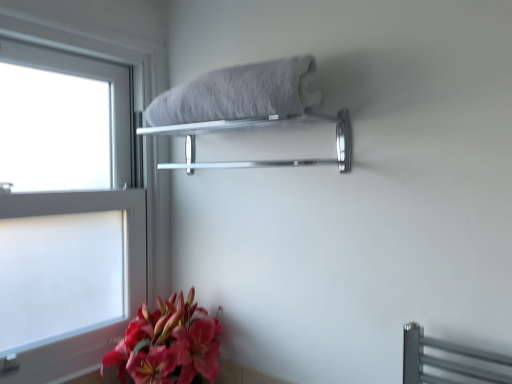
At what (x,y) coordinates should I click in order to perform the action: click on matte pink lily at lower left. Please return your answer as a coordinate pair (x, y). This screenshot has height=384, width=512. Looking at the image, I should click on (168, 345).

What do you see at coordinates (168, 345) in the screenshot? Image resolution: width=512 pixels, height=384 pixels. I see `matte pink lily at lower left` at bounding box center [168, 345].

Measure the distance between silver metallic towel rack at upper center and camera.

silver metallic towel rack at upper center is 99.20 centimeters from camera.

At what (x,y) coordinates should I click in order to perform the action: click on clear glass window at left. Please return your answer as a coordinate pair (x, y). This screenshot has height=384, width=512. Looking at the image, I should click on (65, 213).

How many degrees apart are the facing directions of clear glass window at left and gray fluffy bath towel at upper center?

90.1 degrees separate the facing orientations of clear glass window at left and gray fluffy bath towel at upper center.

Does clear glass window at left turn towards gray fluffy bath towel at upper center?

Yes, clear glass window at left is facing gray fluffy bath towel at upper center.

From their relative heights in the image, would you say clear glass window at left is taller or shorter than gray fluffy bath towel at upper center?

clear glass window at left is taller than gray fluffy bath towel at upper center.

Is clear glass window at left bigger or smaller than gray fluffy bath towel at upper center?

In the image, clear glass window at left appears to be larger than gray fluffy bath towel at upper center.

How many degrees apart are the facing directions of silver metallic towel rack at upper center and clear glass window at left?

The facing directions of silver metallic towel rack at upper center and clear glass window at left are 90.1 degrees apart.

Which object is wider, silver metallic towel rack at upper center or clear glass window at left?

silver metallic towel rack at upper center.

Is silver metallic towel rack at upper center not inside clear glass window at left?

Indeed, silver metallic towel rack at upper center is completely outside clear glass window at left.

Considering the relative sizes of silver metallic towel rack at upper center and clear glass window at left in the image provided, is silver metallic towel rack at upper center smaller than clear glass window at left?

Correct, silver metallic towel rack at upper center occupies less space than clear glass window at left.

Based on the photo, what's the angular difference between silver metallic towel rack at upper center and gray fluffy bath towel at upper center's facing directions?

silver metallic towel rack at upper center and gray fluffy bath towel at upper center are facing 0.00149 degrees away from each other.

Based on the photo, would you say silver metallic towel rack at upper center is a long distance from gray fluffy bath towel at upper center?

No, silver metallic towel rack at upper center is not far from gray fluffy bath towel at upper center.

From a real-world perspective, is silver metallic towel rack at upper center located beneath gray fluffy bath towel at upper center?

Yes, from a real-world perspective, silver metallic towel rack at upper center is beneath gray fluffy bath towel at upper center.

Does silver metallic towel rack at upper center turn towards gray fluffy bath towel at upper center?

No, silver metallic towel rack at upper center is not turned towards gray fluffy bath towel at upper center.

Is matte pink lily at lower left completely or partially outside of gray fluffy bath towel at upper center?

matte pink lily at lower left is positioned outside gray fluffy bath towel at upper center.

Is matte pink lily at lower left not close to gray fluffy bath towel at upper center?

matte pink lily at lower left is actually quite close to gray fluffy bath towel at upper center.

Considering the relative sizes of matte pink lily at lower left and gray fluffy bath towel at upper center in the image provided, is matte pink lily at lower left smaller than gray fluffy bath towel at upper center?

No, matte pink lily at lower left is not smaller than gray fluffy bath towel at upper center.

Does matte pink lily at lower left have a lesser height compared to gray fluffy bath towel at upper center?

Incorrect, the height of matte pink lily at lower left does not fall short of that of gray fluffy bath towel at upper center.

From a real-world perspective, is gray fluffy bath towel at upper center above or below matte pink lily at lower left?

From a real-world perspective, gray fluffy bath towel at upper center is physically above matte pink lily at lower left.

Can you confirm if gray fluffy bath towel at upper center is taller than matte pink lily at lower left?

In fact, gray fluffy bath towel at upper center may be shorter than matte pink lily at lower left.

Is gray fluffy bath towel at upper center facing towards matte pink lily at lower left?

No, gray fluffy bath towel at upper center is not aimed at matte pink lily at lower left.

Based on the photo, which object is positioned more to the left, gray fluffy bath towel at upper center or silver metallic towel rack at upper center?

From the viewer's perspective, silver metallic towel rack at upper center appears more on the left side.

From a real-world perspective, is gray fluffy bath towel at upper center located higher than silver metallic towel rack at upper center?

Correct, in the physical world, gray fluffy bath towel at upper center is higher than silver metallic towel rack at upper center.

Would you consider gray fluffy bath towel at upper center to be distant from silver metallic towel rack at upper center?

Actually, gray fluffy bath towel at upper center and silver metallic towel rack at upper center are a little close together.

Which is correct: gray fluffy bath towel at upper center is inside silver metallic towel rack at upper center, or outside of it?

gray fluffy bath towel at upper center is outside silver metallic towel rack at upper center.

From the image's perspective, is matte pink lily at lower left below clear glass window at left?

Yes, from the image's perspective, matte pink lily at lower left is beneath clear glass window at left.

Does point (182, 332) come behind point (75, 127)?

No, (182, 332) is closer to viewer.

Is matte pink lily at lower left aimed at clear glass window at left?

No, matte pink lily at lower left is not turned towards clear glass window at left.

Locate an element on the screen. The width and height of the screenshot is (512, 384). bath towel above the clear glass window at left (from the image's perspective) is located at coordinates (240, 94).

In order to click on balustrade in front of the clear glass window at left in this screenshot , I will do `click(254, 129)`.

From the picture: When comparing their distances from gray fluffy bath towel at upper center, does matte pink lily at lower left or clear glass window at left seem further?

The object further to gray fluffy bath towel at upper center is matte pink lily at lower left.

When comparing their distances from gray fluffy bath towel at upper center, does clear glass window at left or matte pink lily at lower left seem closer?

clear glass window at left.

Which object lies nearer to the anchor point matte pink lily at lower left, gray fluffy bath towel at upper center or silver metallic towel rack at upper center?

Among the two, silver metallic towel rack at upper center is located nearer to matte pink lily at lower left.

Which object lies further to the anchor point clear glass window at left, silver metallic towel rack at upper center or matte pink lily at lower left?

Among the two, silver metallic towel rack at upper center is located further to clear glass window at left.

Which object lies nearer to the anchor point matte pink lily at lower left, gray fluffy bath towel at upper center or clear glass window at left?

The object closer to matte pink lily at lower left is clear glass window at left.

When comparing their distances from gray fluffy bath towel at upper center, does clear glass window at left or silver metallic towel rack at upper center seem further?

Among the two, clear glass window at left is located further to gray fluffy bath towel at upper center.

From the image, which object appears to be farther from clear glass window at left, silver metallic towel rack at upper center or gray fluffy bath towel at upper center?

gray fluffy bath towel at upper center is further to clear glass window at left.

Looking at the image, which one is located closer to silver metallic towel rack at upper center, gray fluffy bath towel at upper center or clear glass window at left?

Among the two, gray fluffy bath towel at upper center is located nearer to silver metallic towel rack at upper center.

This screenshot has width=512, height=384. In order to click on window between silver metallic towel rack at upper center and matte pink lily at lower left from top to bottom in this screenshot , I will do `click(65, 213)`.

You are a GUI agent. You are given a task and a screenshot of the screen. Output one action in this format:
    pyautogui.click(x=<x>, y=<y>)
    Task: Click on the balustrade between gray fluffy bath towel at upper center and matte pink lily at lower left in the vertical direction
    The width and height of the screenshot is (512, 384).
    Given the screenshot: What is the action you would take?
    pyautogui.click(x=254, y=129)

Image resolution: width=512 pixels, height=384 pixels. Find the location of `balustrade situated between clear glass window at left and gray fluffy bath towel at upper center from left to right`. balustrade situated between clear glass window at left and gray fluffy bath towel at upper center from left to right is located at coordinates (254, 129).

Where is `window between gray fluffy bath towel at upper center and matte pink lily at lower left in the vertical direction`? window between gray fluffy bath towel at upper center and matte pink lily at lower left in the vertical direction is located at coordinates (65, 213).